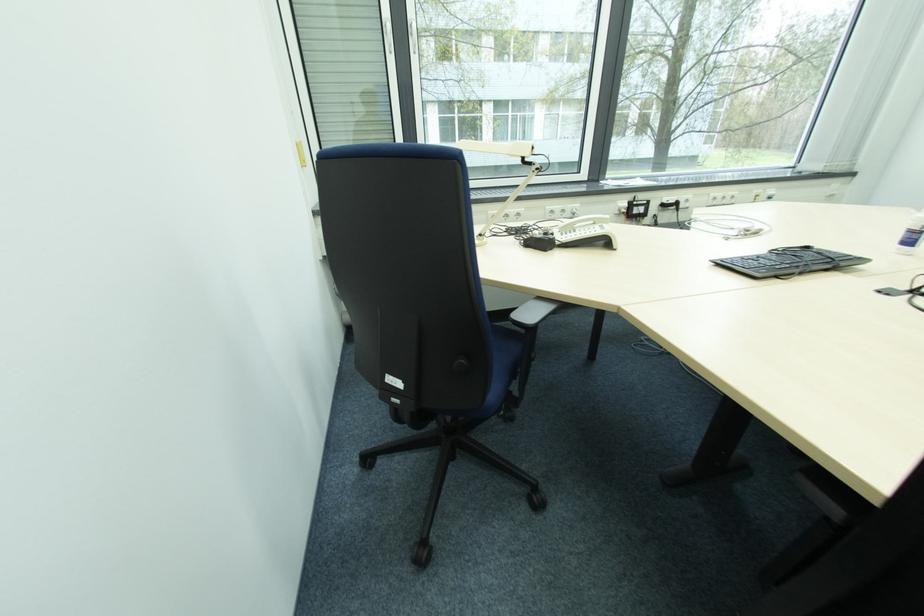
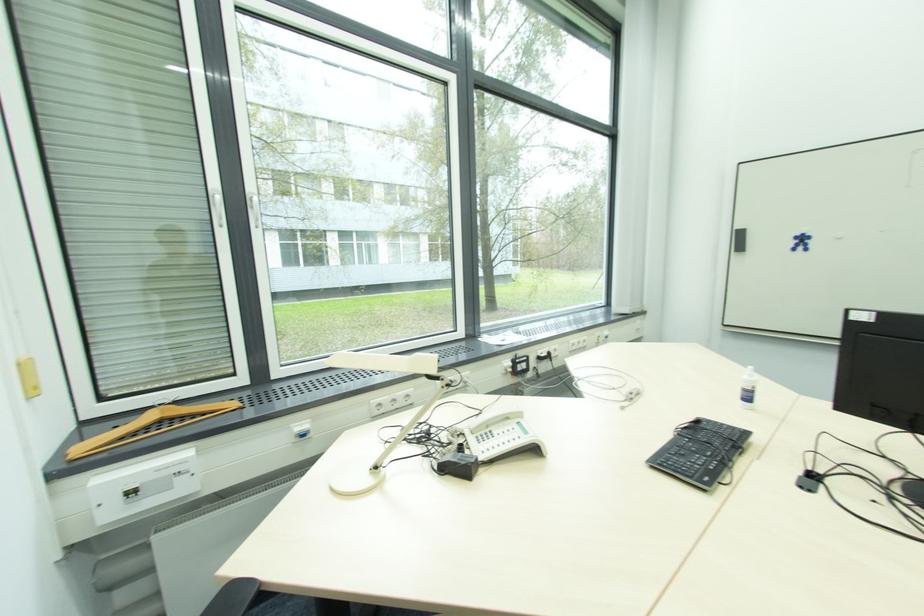
The point at (808, 251) is marked in the first image. Where is the corresponding point in the second image?

(700, 424)